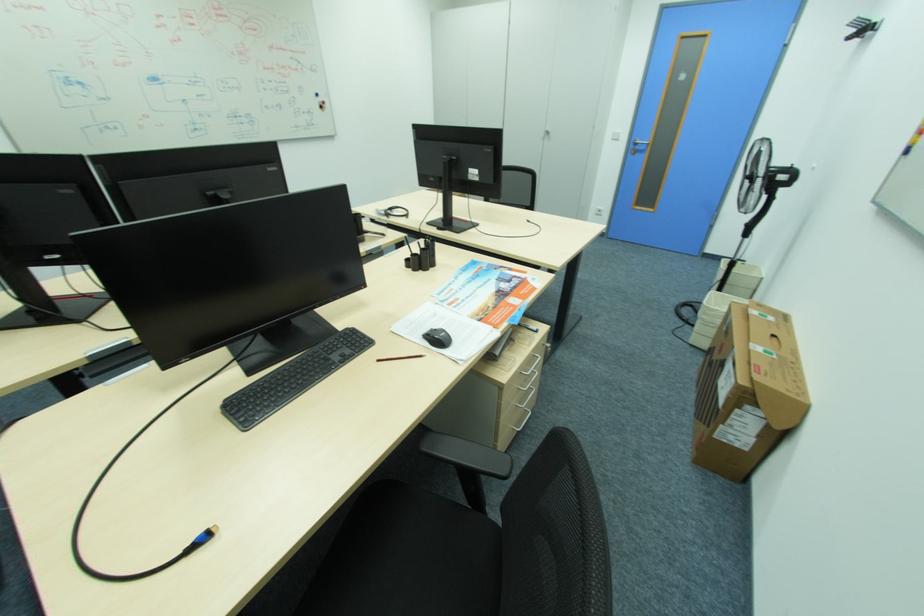
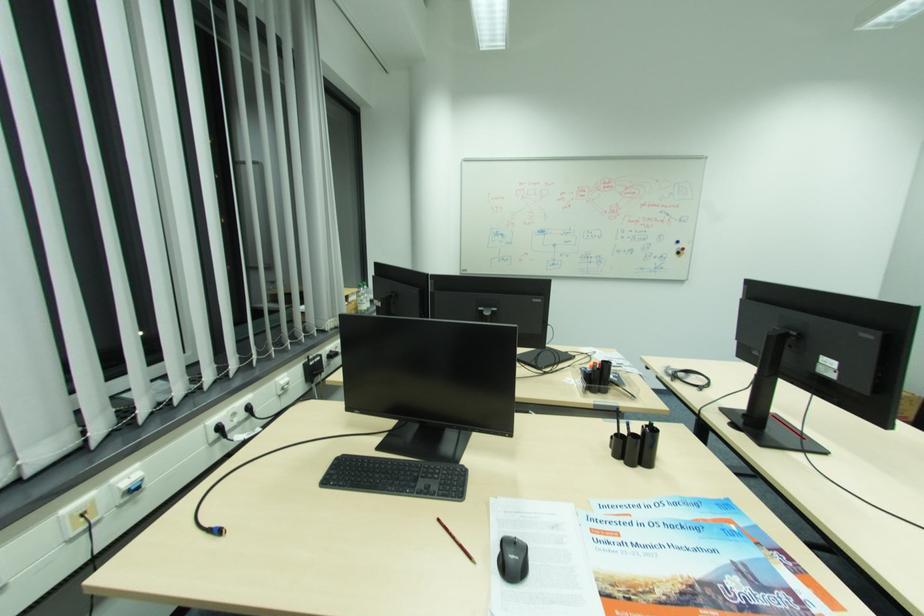
Find the pixel in the second image that matches point (327, 108) in the first image.

(684, 253)